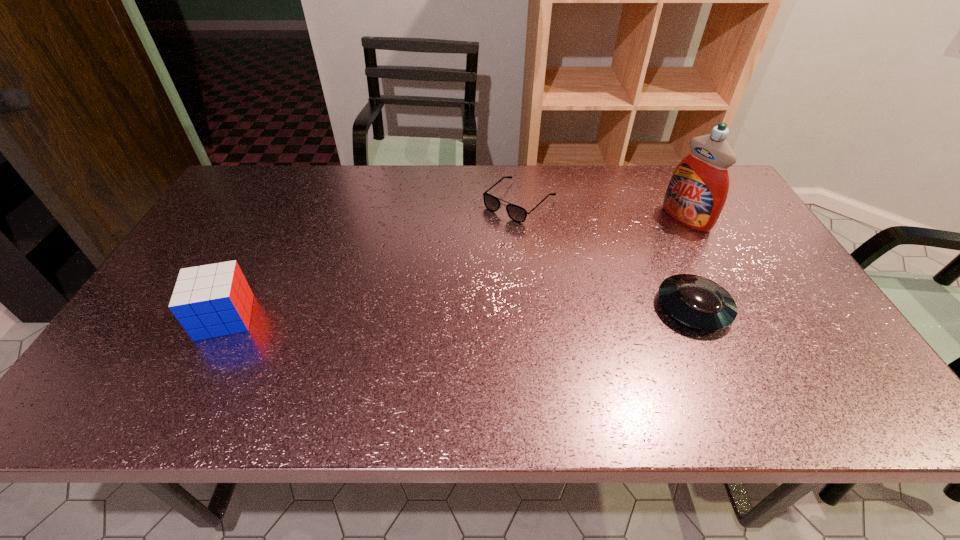
Locate an element on the screen. free region at the far edge is located at coordinates (555, 173).

Locate an element on the screen. The height and width of the screenshot is (540, 960). vacant space at the near edge of the desktop is located at coordinates (307, 349).

The image size is (960, 540). Identify the location of vacant area at the left edge of the desktop. (216, 224).

At what (x,y) coordinates should I click in order to perform the action: click on free space at the right edge of the desktop. Please return your answer as a coordinate pair (x, y). Looking at the image, I should click on (736, 232).

In the image, there is a desktop. Identify the location of vacant space at the near right corner. This screenshot has width=960, height=540. (805, 366).

The image size is (960, 540). Find the location of `empty space between the saucer and the third object from right to left`. empty space between the saucer and the third object from right to left is located at coordinates (607, 254).

In order to click on free space between the cube and the spectacles in this screenshot , I will do `click(372, 259)`.

Locate an element on the screen. Image resolution: width=960 pixels, height=540 pixels. vacant space in between the tallest object and the third shortest object is located at coordinates (455, 268).

Where is `free space between the tallest object and the saucer`? This screenshot has height=540, width=960. free space between the tallest object and the saucer is located at coordinates (689, 263).

Identify the location of unoccupied position between the tallest object and the spectacles. [603, 210].